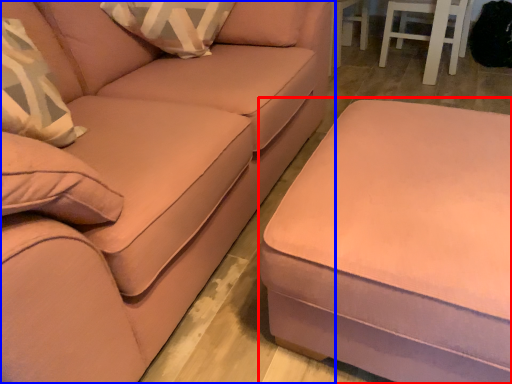
Question: Which object is further to the camera taking this photo, table (highlighted by a red box) or studio couch (highlighted by a blue box)?

Choices:
 (A) table
 (B) studio couch

Answer: (A)